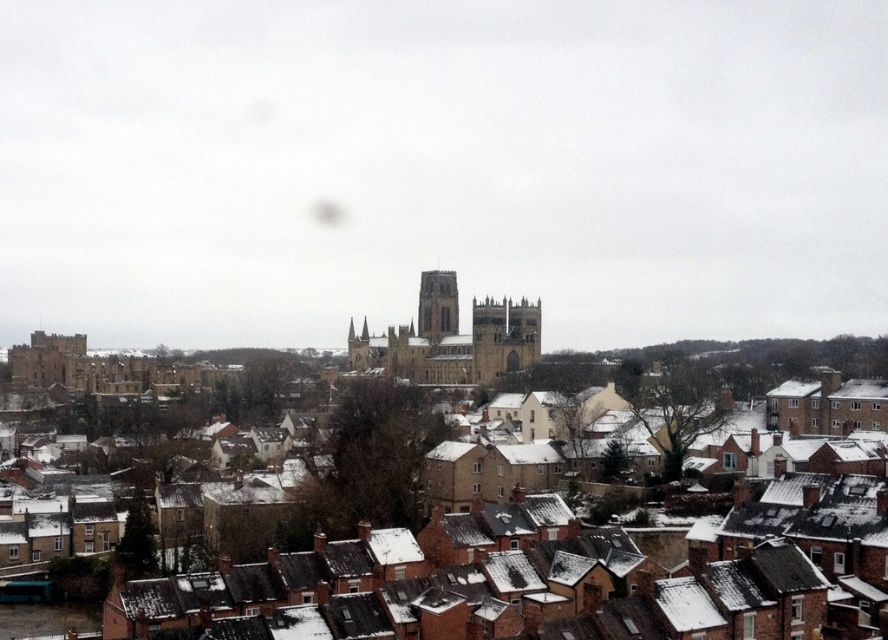
You are standing in the cityscape and want to determine the order of the two points from your viewpoint. Which point is closer to you, point [868,364] or point [423,278]?

Point [868,364] is in front of point [423,278], so it is closer to you.

You are a tourist standing in front of the brown brick houses at lower center and want to take a photo of the brown stone tower at center. Which direction should you turn to face the tower?

The brown brick houses at lower center are positioned on the right side of the brown stone tower at center, so you should turn to your left to face the tower.